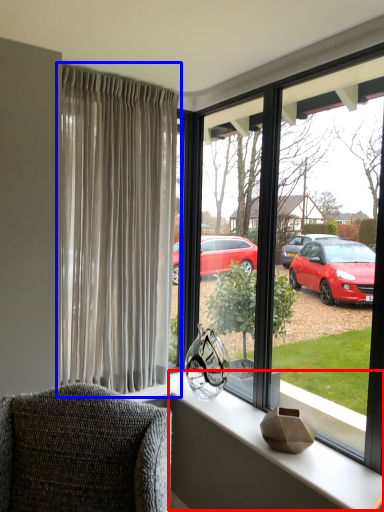
Question: Which object is further to the camera taking this photo, window sill (highlighted by a red box) or curtain (highlighted by a blue box)?

Choices:
 (A) window sill
 (B) curtain

Answer: (B)